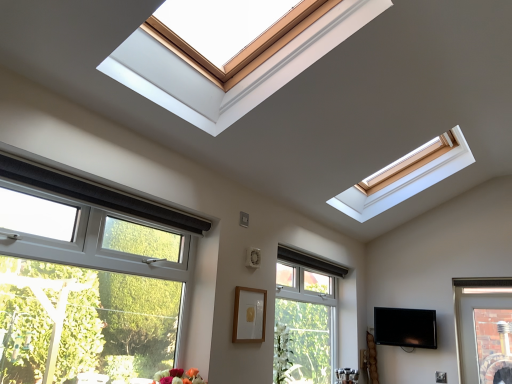
Question: Is black glossy tv at lower right far from clear glass window at center, the 2th window from the left?

Choices:
 (A) no
 (B) yes

Answer: (A)

Question: Can you confirm if black glossy tv at lower right is wider than clear glass window at center, placed as the second window when sorted from front to back?

Choices:
 (A) yes
 (B) no

Answer: (A)

Question: From the image's perspective, is black glossy tv at lower right on clear glass window at center, the first window from the back?

Choices:
 (A) no
 (B) yes

Answer: (A)

Question: Can clear glass window at center, the first window from the back, be found inside black glossy tv at lower right?

Choices:
 (A) no
 (B) yes

Answer: (A)

Question: Considering the relative positions of black glossy tv at lower right and clear glass window at center, placed as the second window when sorted from front to back, in the image provided, is black glossy tv at lower right behind clear glass window at center, placed as the second window when sorted from front to back,?

Choices:
 (A) yes
 (B) no

Answer: (A)

Question: Considering their positions, is clear glass window at center, placed as the second window when sorted from front to back, located in front of or behind black glossy tv at lower right?

Choices:
 (A) front
 (B) behind

Answer: (A)

Question: Based on their positions, is clear glass window at center, which appears as the 1th window when viewed from the right, located to the left or right of black glossy tv at lower right?

Choices:
 (A) left
 (B) right

Answer: (A)

Question: From their relative heights in the image, would you say clear glass window at center, placed as the second window when sorted from front to back, is taller or shorter than black glossy tv at lower right?

Choices:
 (A) tall
 (B) short

Answer: (A)

Question: Based on their sizes in the image, would you say clear glass window at center, the 2th window from the left, is bigger or smaller than black glossy tv at lower right?

Choices:
 (A) big
 (B) small

Answer: (A)

Question: Is white plastic window at lower left, which ranks as the first window in left-to-right order, in front of or behind wooden picture frame at center in the image?

Choices:
 (A) front
 (B) behind

Answer: (A)

Question: From a real-world perspective, relative to wooden picture frame at center, is white plastic window at lower left, which is the 2th window in back-to-front order, vertically above or below?

Choices:
 (A) above
 (B) below

Answer: (A)

Question: Is white plastic window at lower left, the first window in the front-to-back sequence, to the left or to the right of wooden picture frame at center in the image?

Choices:
 (A) right
 (B) left

Answer: (B)

Question: Considering the positions of white plastic window at lower left, the first window in the front-to-back sequence, and wooden picture frame at center in the image, is white plastic window at lower left, the first window in the front-to-back sequence, wider or thinner than wooden picture frame at center?

Choices:
 (A) thin
 (B) wide

Answer: (B)

Question: Considering the positions of point pyautogui.click(x=410, y=314) and point pyautogui.click(x=288, y=332), is point pyautogui.click(x=410, y=314) closer or farther from the camera than point pyautogui.click(x=288, y=332)?

Choices:
 (A) closer
 (B) farther

Answer: (B)

Question: In the image, is black glossy tv at lower right positioned in front of or behind clear glass window at center, placed as the second window when sorted from front to back?

Choices:
 (A) front
 (B) behind

Answer: (B)